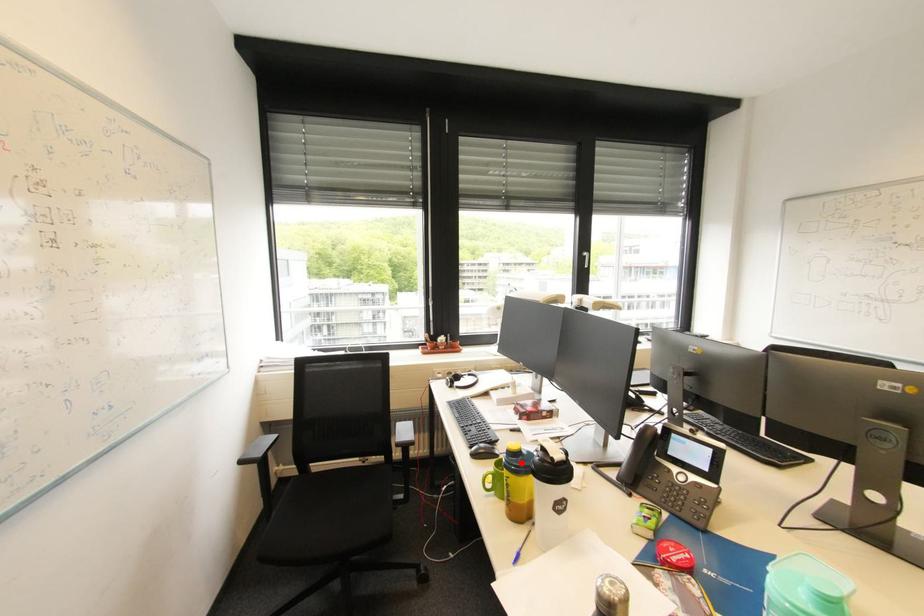
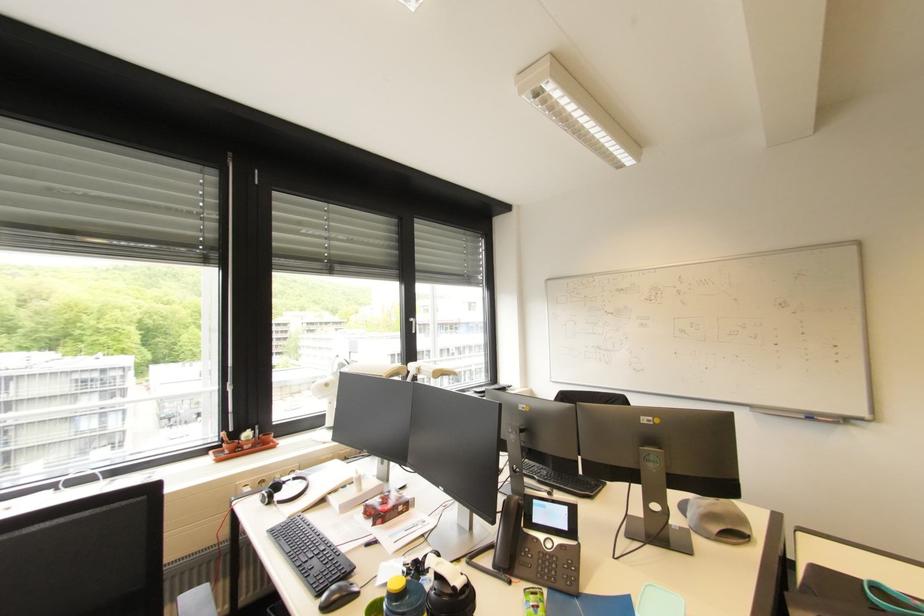
Question: I am providing you with two images of the same scene from different viewpoints. In image1, a red point is highlighted. Considering the same 3D point in image2, which of the following is correct?

Choices:
 (A) It is closer
 (B) It is farther

Answer: (B)